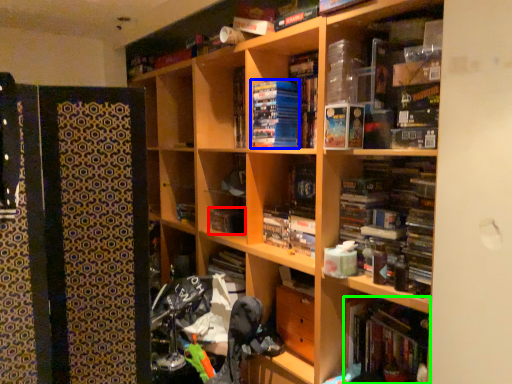
Question: Estimate the real-world distances between objects in this image. Which object is closer to book (highlighted by a red box), paperback book (highlighted by a blue box) or book (highlighted by a green box)?

Choices:
 (A) paperback book
 (B) book

Answer: (A)